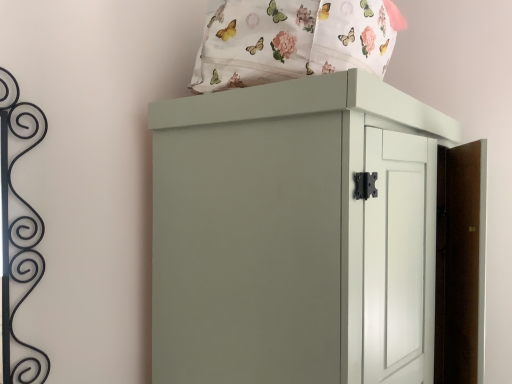
At what (x,y) coordinates should I click in order to perform the action: click on matte gray cupboard at upper center. Please return your answer as a coordinate pair (x, y). The width and height of the screenshot is (512, 384). Looking at the image, I should click on (295, 233).

What is the approximate width of matte gray cupboard at upper center?

28.34 inches.

This screenshot has width=512, height=384. Describe the element at coordinates (295, 233) in the screenshot. I see `matte gray cupboard at upper center` at that location.

This screenshot has width=512, height=384. In order to click on matte gray cupboard at upper center in this screenshot , I will do `click(295, 233)`.